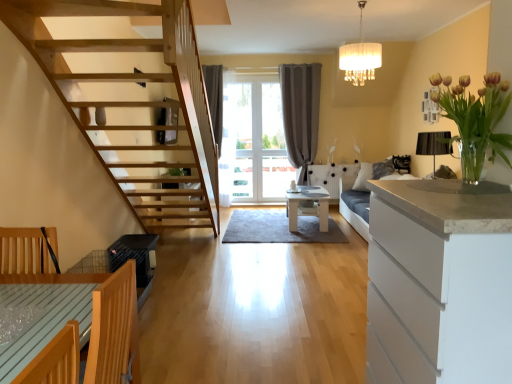
Question: From the image's perspective, relative to light brown wooden table at lower left, marked as the 1th table in a left-to-right arrangement, is white matte cabinet at right above or below?

Choices:
 (A) above
 (B) below

Answer: (A)

Question: Is white matte cabinet at right wider or thinner than light brown wooden table at lower left, positioned as the 1th table in bottom-to-top order?

Choices:
 (A) wide
 (B) thin

Answer: (B)

Question: Based on their relative distances, which object is farther from the white glossy table at center, positioned as the 1th table in right-to-left order?

Choices:
 (A) white matte cabinet at right
 (B) light brown wooden table at lower left, marked as the second table in a right-to-left arrangement
 (C) white fabric lampshade at upper center
 (D) gray fabric curtain at center
 (E) translucent glass vase at upper right

Answer: (B)

Question: Which of these objects is positioned closest to the gray fabric curtain at center?

Choices:
 (A) white matte cabinet at right
 (B) white fabric lampshade at upper center
 (C) white glossy table at center, which ranks as the second table in front-to-back order
 (D) light brown wooden table at lower left, the second table viewed from the top
 (E) translucent glass vase at upper right

Answer: (C)